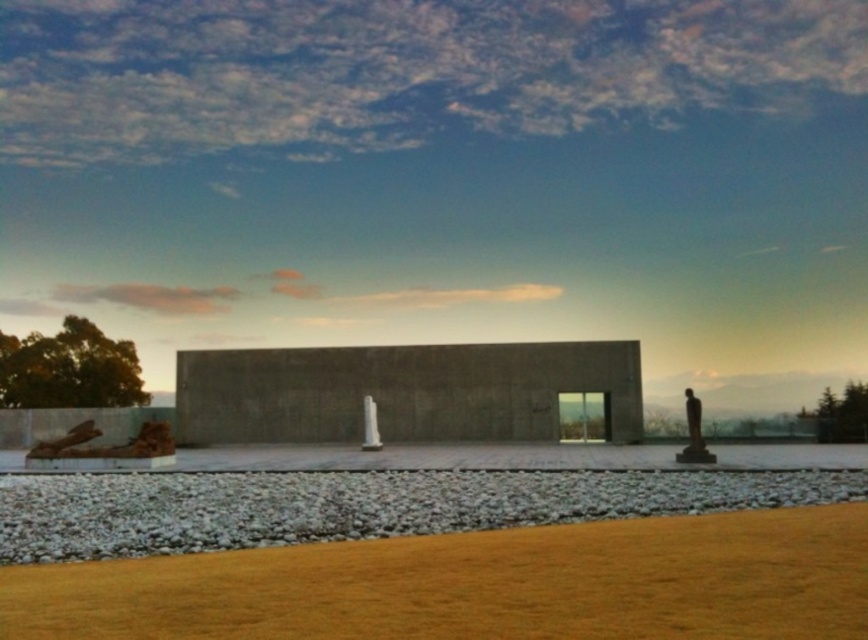
Is dark gray concrete wall at center thinner than polished bronze statue at right?

No, dark gray concrete wall at center is not thinner than polished bronze statue at right.

Measure the distance between point (319,364) and camera.

A distance of 39.63 meters exists between point (319,364) and camera.

Image resolution: width=868 pixels, height=640 pixels. I want to click on dark gray concrete wall at center, so click(x=402, y=392).

Is point (201, 372) in front of point (365, 417)?

No, it is behind (365, 417).

Can you confirm if dark gray concrete wall at center is smaller than white concrete column at center?

Incorrect, dark gray concrete wall at center is not smaller in size than white concrete column at center.

Where is `dark gray concrete wall at center`? The height and width of the screenshot is (640, 868). dark gray concrete wall at center is located at coordinates pyautogui.click(x=402, y=392).

Locate an element on the screen. dark gray concrete wall at center is located at coordinates (402, 392).

Can you confirm if white gravel at lower center is shorter than rustic wood log at lower left?

Yes, white gravel at lower center is shorter than rustic wood log at lower left.

Describe the element at coordinates (358, 506) in the screenshot. I see `white gravel at lower center` at that location.

Measure the distance between white gravel at lower center and camera.

white gravel at lower center is 12.87 meters from camera.

This screenshot has height=640, width=868. In order to click on white gravel at lower center in this screenshot , I will do `click(358, 506)`.